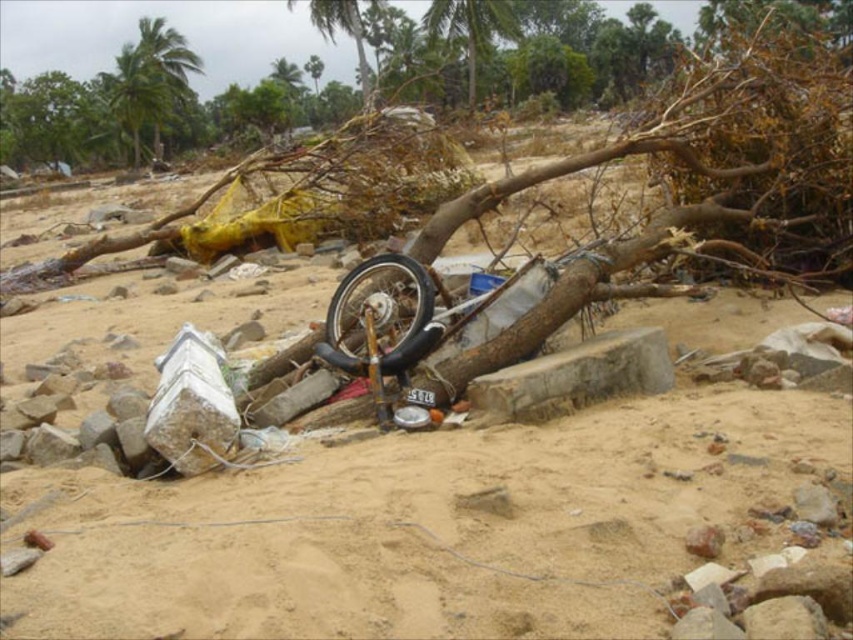
You are a rescue worker trying to navigate through the debris field. You see the black rubber wheel at center and the green leafy palm tree at upper center. Which object is located to the left of the other?

The black rubber wheel at center is positioned on the left side of green leafy palm tree at upper center.

You are a rescue worker trying to navigate through the disaster area shown in the image. You need to reach a green leafy palm tree at upper left located at point (135, 92). What is the nearest object to this point?

The nearest object to point (135, 92) is the green leafy palm tree at upper left itself, as it is located exactly at that coordinate.

You are a rescue worker trying to reach a survivor trapped under debris. You see the black rubber wheel at center and the green leafy palm tree at upper center. Which object is closer to you?

The black rubber wheel at center is closer to you because it is positioned under the green leafy palm tree at upper center, meaning the palm tree is further away.